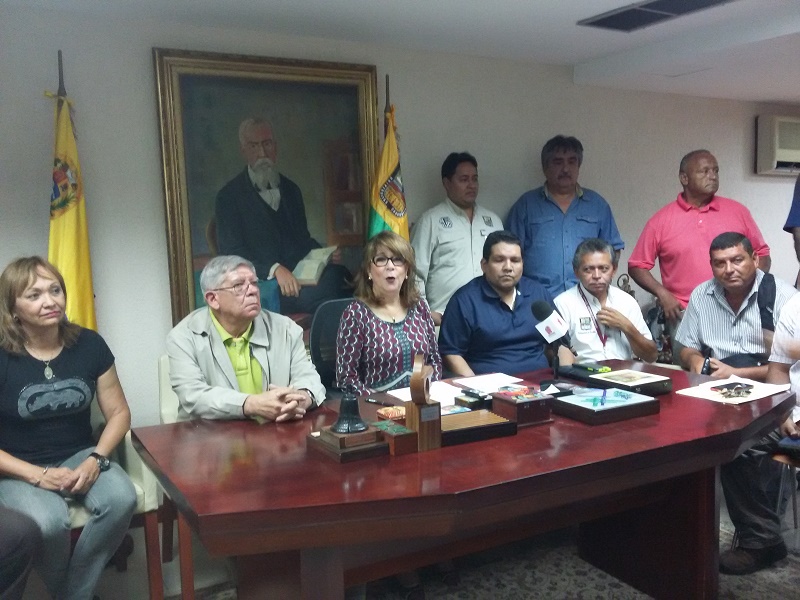
Identify the location of table. (437, 473).